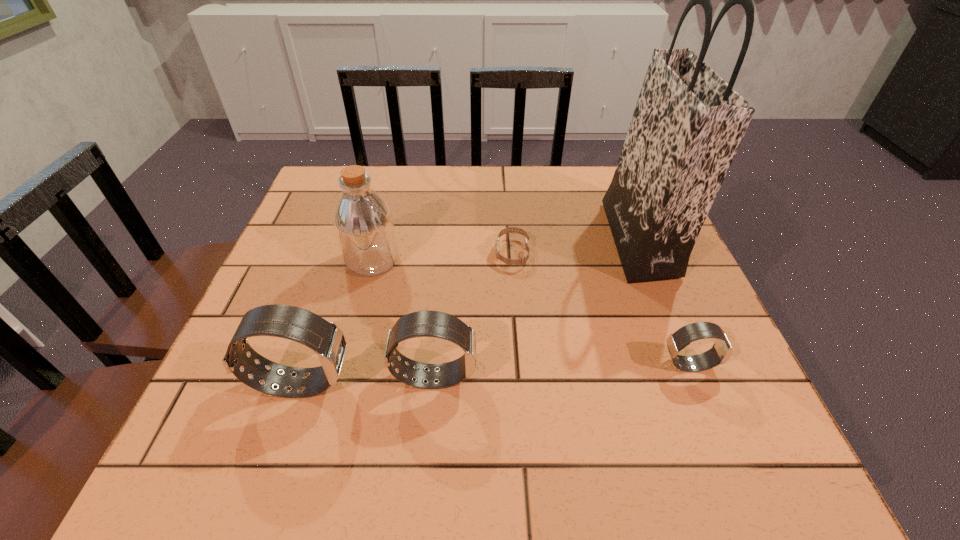
Identify the location of the leftmost watch. point(325,338).

At what (x,y) coordinates should I click in order to perform the action: click on the second watch from left to right. Please return your answer as a coordinate pair (x, y). Looking at the image, I should click on (436, 324).

Where is `the third shortest watch`? The image size is (960, 540). the third shortest watch is located at coordinates (436, 324).

Where is `the fifth tallest object`? the fifth tallest object is located at coordinates (721, 351).

Where is `the third tallest watch`? the third tallest watch is located at coordinates (721, 351).

Where is `the second watch from right to left`? the second watch from right to left is located at coordinates (523, 260).

Where is `the shortest object`? the shortest object is located at coordinates (523, 260).

Where is `shopping bag`? The height and width of the screenshot is (540, 960). shopping bag is located at coordinates (688, 123).

What are the coordinates of `bottle` in the screenshot? It's located at (363, 222).

Find the location of a particular element. The image size is (960, 540). free space located on the face of the leftmost watch is located at coordinates (543, 383).